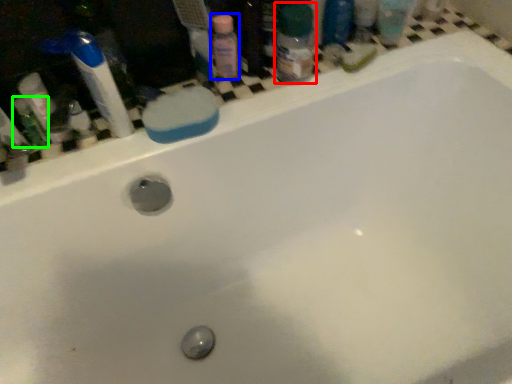
Question: Considering the real-world distances, which object is farthest from toiletry (highlighted by a red box)? cleaning product (highlighted by a blue box) or mouthwash (highlighted by a green box)?

Choices:
 (A) cleaning product
 (B) mouthwash

Answer: (B)